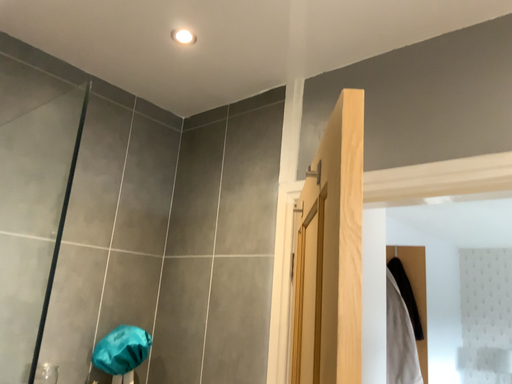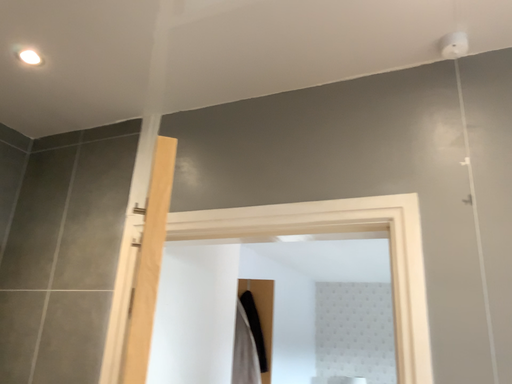
Question: How did the camera likely rotate when shooting the video?

Choices:
 (A) rotated left
 (B) rotated right

Answer: (B)